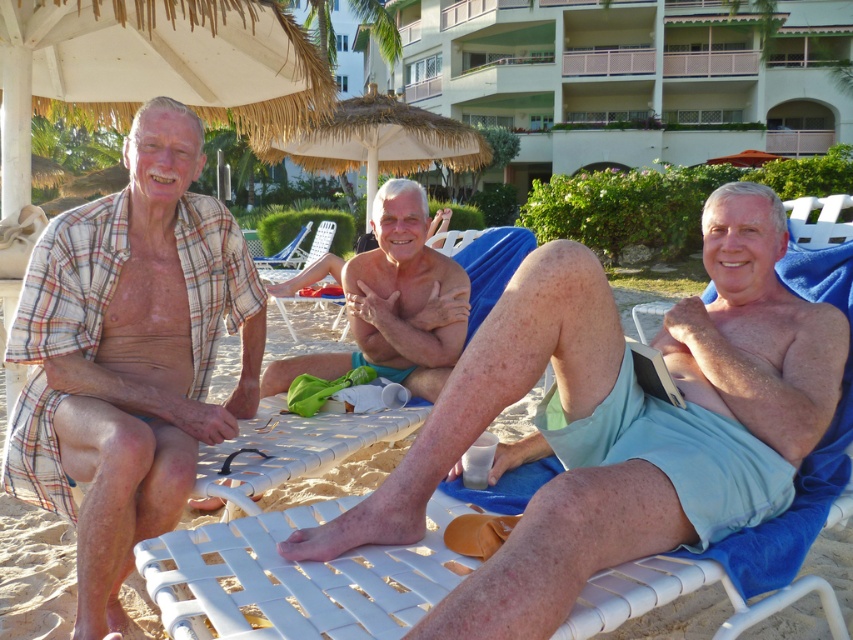
Is light blue fabric shorts at center positioned at the back of white matte skin at center?

That is False.

Is light blue fabric shorts at center bigger than white matte skin at center?

Indeed, light blue fabric shorts at center has a larger size compared to white matte skin at center.

Locate an element on the screen. The height and width of the screenshot is (640, 853). light blue fabric shorts at center is located at coordinates (492, 390).

Locate an element on the screen. Image resolution: width=853 pixels, height=640 pixels. light blue fabric shorts at center is located at coordinates (492, 390).

Who is lower down, plaid fabric shirt at left or white plastic beach chair at center?

Positioned lower is plaid fabric shirt at left.

Is point (199, 134) less distant than point (265, 262)?

That is True.

In order to click on plaid fabric shirt at left in this screenshot , I will do `click(129, 355)`.

In order to click on plaid fabric shirt at left in this screenshot , I will do `click(129, 355)`.

What do you see at coordinates (129, 355) in the screenshot?
I see `plaid fabric shirt at left` at bounding box center [129, 355].

Is plaid fabric shirt at left wider than white matte skin at center?

Incorrect, plaid fabric shirt at left's width does not surpass white matte skin at center's.

Which is behind, point (84, 406) or point (408, 253)?

Positioned behind is point (408, 253).

Where is `plaid fabric shirt at left`? This screenshot has height=640, width=853. plaid fabric shirt at left is located at coordinates (129, 355).